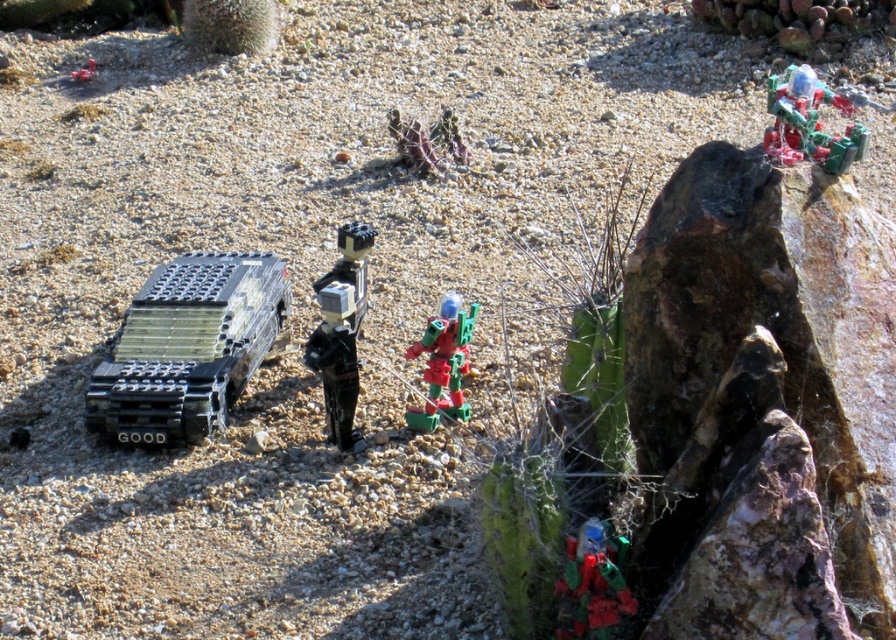
Question: Does black matte figure at center have a smaller size compared to shiny plastic robot at upper right?

Choices:
 (A) yes
 (B) no

Answer: (B)

Question: Which object is closer to the camera taking this photo?

Choices:
 (A) shiny plastic robot at upper right
 (B) shiny metallic figure at center

Answer: (A)

Question: Which object is farther from the camera taking this photo?

Choices:
 (A) black matte figure at center
 (B) green plastic cactus at center
 (C) shiny metallic figure at center

Answer: (B)

Question: Is shiny plastic robot at upper right further to the viewer compared to shiny metallic figure at center?

Choices:
 (A) no
 (B) yes

Answer: (A)

Question: Does black matte figure at center appear on the right side of shiny metallic robot at lower right?

Choices:
 (A) no
 (B) yes

Answer: (A)

Question: Which of these objects is positioned closest to the black matte figure at center?

Choices:
 (A) black plastic tank at left
 (B) shiny metallic figure at center

Answer: (B)